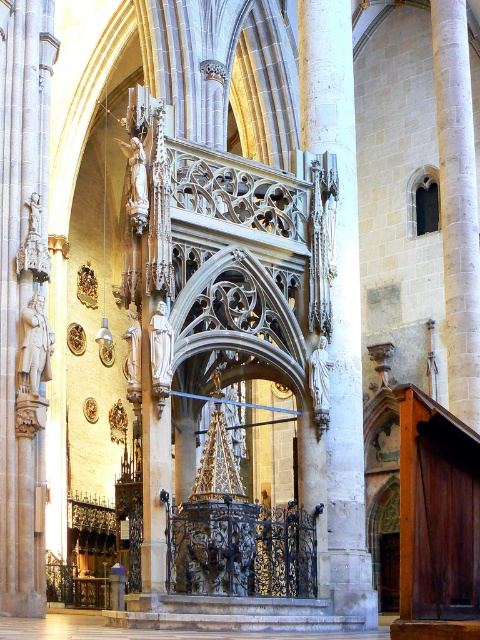
You are standing inside the cathedral and want to take a closer look at the white stone column at center. However, you notice the polished stone statue at left is in your way. Can you walk around it to reach the column?

The white stone column at center is behind the polished stone statue at left, so you can walk around the polished stone statue at left to access the column.

You are an art student visiting the cathedral and want to sketch both the polished stone statue at left and the white marble statue at right. Which statue should you choose if you want to draw a taller one?

The polished stone statue at left is much taller than the white marble statue at right, so you should choose the polished stone statue at left to draw the taller one.